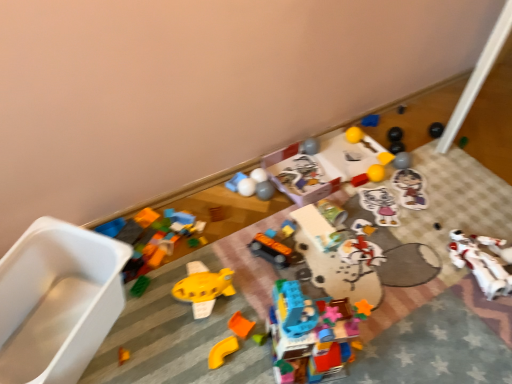
Locate an element on the screen. free space in front of yellow rubber ball at upper center, the 3th toy in the right-to-left sequence is located at coordinates (390, 191).